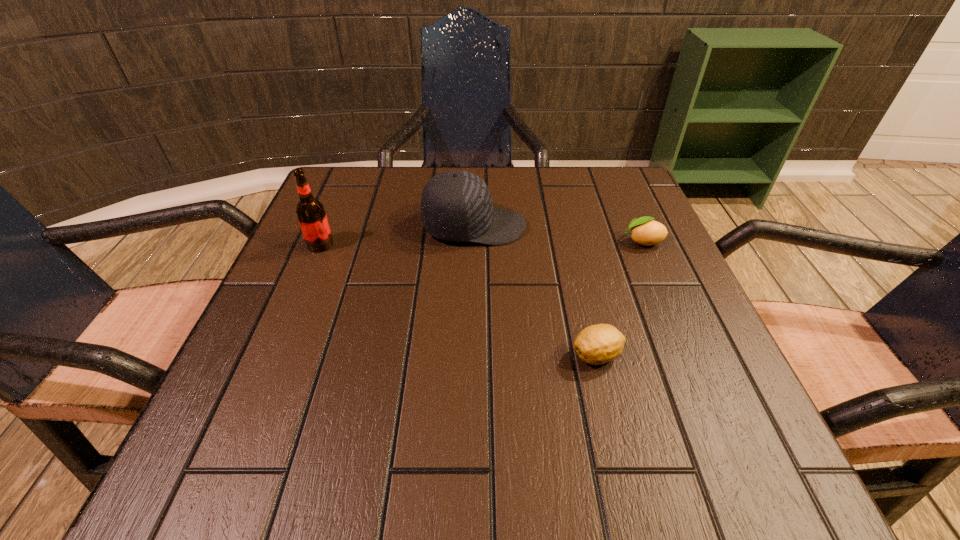
The width and height of the screenshot is (960, 540). In order to click on blank area located at the stem end of the third object from left to right in this screenshot , I will do `click(474, 355)`.

Where is `vacant space located 0.340m at the stem end of the third object from left to right`? The image size is (960, 540). vacant space located 0.340m at the stem end of the third object from left to right is located at coordinates (353, 355).

I want to click on free space located 0.390m at the stem end of the third object from left to right, so click(x=322, y=355).

This screenshot has width=960, height=540. What are the coordinates of `vacant region located 0.290m with leaves positioned above the right lemon` in the screenshot? It's located at (479, 241).

Identify the location of vacant area located with leaves positioned above the right lemon. (563, 241).

I want to click on free space located with leaves positioned above the right lemon, so click(503, 241).

Locate an element on the screen. The image size is (960, 540). object positioned at the far edge is located at coordinates (456, 205).

The image size is (960, 540). In order to click on object present at the left edge in this screenshot , I will do `click(310, 212)`.

The image size is (960, 540). In the image, there is a desktop. What are the coordinates of `free space at the far edge` in the screenshot? It's located at (492, 172).

In order to click on free space at the left edge of the desktop in this screenshot , I will do `click(291, 295)`.